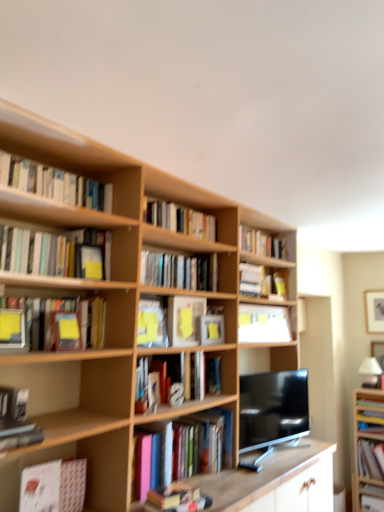
The width and height of the screenshot is (384, 512). I want to click on free spot above matte yellow book at upper left, which appears as the 4th book when viewed from the top (from a real-world perspective), so click(x=48, y=219).